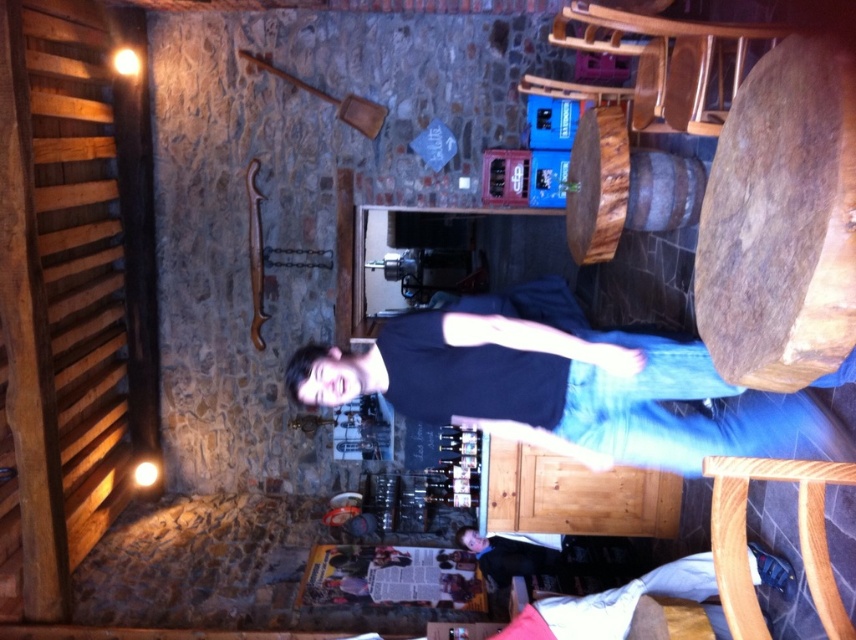
Question: Which point is closer to the camera taking this photo?

Choices:
 (A) (494, 584)
 (B) (771, 556)
 (C) (489, 344)

Answer: (C)

Question: Does dark blue t-shirt at center appear on the right side of dark blue shirt at lower center?

Choices:
 (A) no
 (B) yes

Answer: (B)

Question: Which object appears closest to the camera in this image?

Choices:
 (A) dark blue t-shirt at center
 (B) dark blue shirt at lower center
 (C) denim jeans at lower right

Answer: (A)

Question: Can you confirm if dark blue t-shirt at center is wider than denim jeans at lower right?

Choices:
 (A) yes
 (B) no

Answer: (A)

Question: Is dark blue t-shirt at center thinner than dark blue shirt at lower center?

Choices:
 (A) no
 (B) yes

Answer: (A)

Question: Which point is closer to the camera?

Choices:
 (A) dark blue shirt at lower center
 (B) dark blue t-shirt at center

Answer: (B)